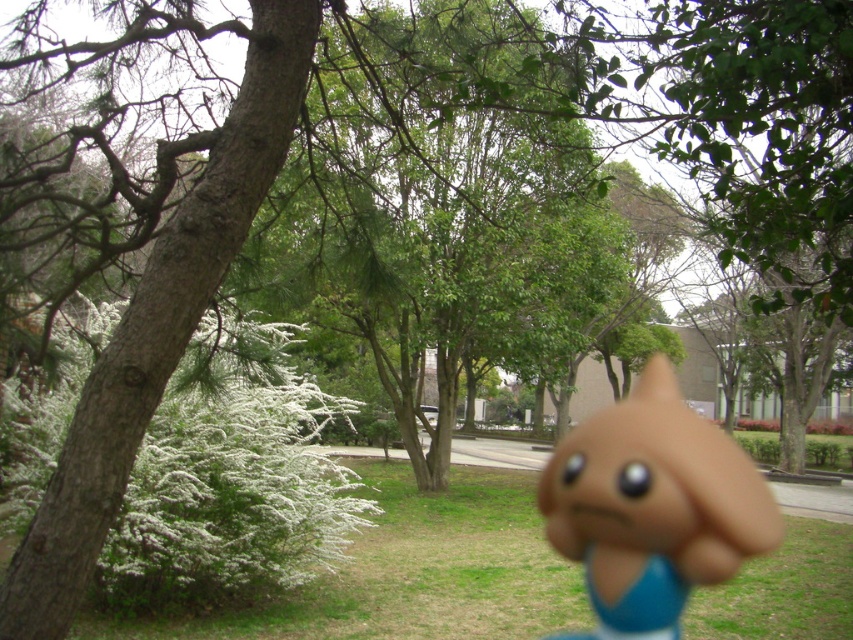
Question: Which point is closer to the camera?

Choices:
 (A) brown rubber toy at center
 (B) green grass at lower left

Answer: (B)

Question: Is green grass at lower left to the left of brown rubber toy at center from the viewer's perspective?

Choices:
 (A) yes
 (B) no

Answer: (A)

Question: Is green grass at lower left to the right of brown rubber toy at center from the viewer's perspective?

Choices:
 (A) yes
 (B) no

Answer: (B)

Question: Which point is farther to the camera?

Choices:
 (A) (341, 589)
 (B) (647, 372)

Answer: (B)

Question: Can you confirm if green grass at lower left is positioned to the left of brown rubber toy at center?

Choices:
 (A) yes
 (B) no

Answer: (A)